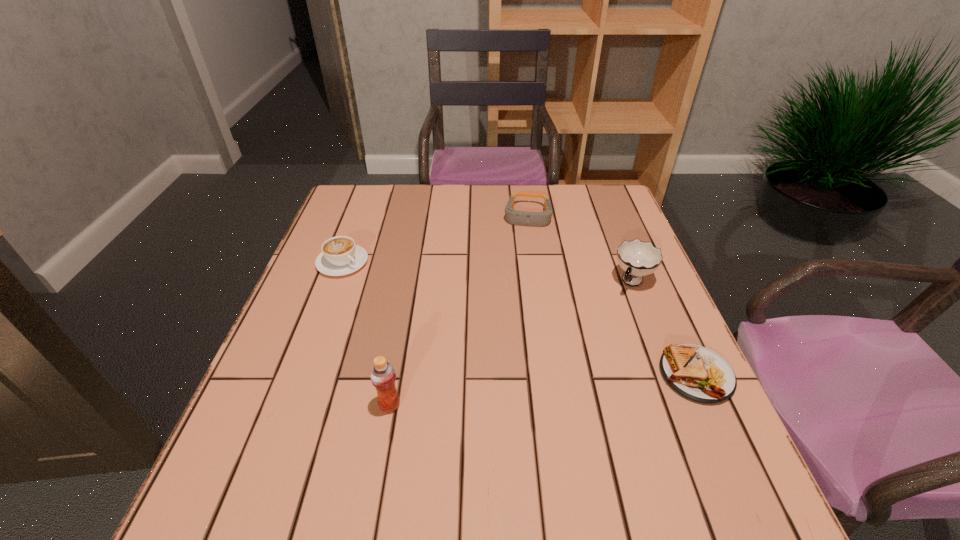
The height and width of the screenshot is (540, 960). What are the coordinates of `vacant space on the desktop that is between the fourth object from right to left and the shortest object and is positioned on the side of the cappuccino with the handle` in the screenshot? It's located at (517, 392).

The image size is (960, 540). In order to click on vacant space on the desktop that is between the tallest object and the shortest object and is positioned on the front and back of the goggles in this screenshot , I will do `click(513, 393)`.

Find the location of `vacant space on the desktop that is between the second object from left to right and the shortest object and is positioned on the side of the second tallest object with the handle`. vacant space on the desktop that is between the second object from left to right and the shortest object and is positioned on the side of the second tallest object with the handle is located at coordinates (565, 387).